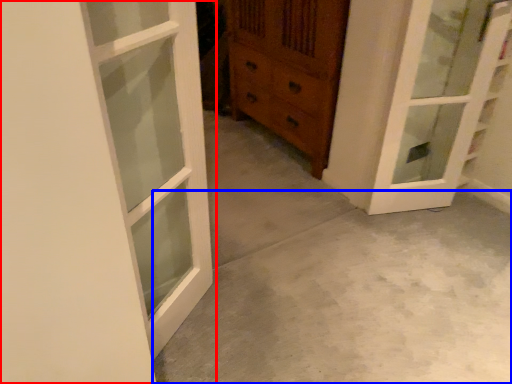
Question: Which of the following is the closest to the observer, door (highlighted by a red box) or concrete (highlighted by a blue box)?

Choices:
 (A) door
 (B) concrete

Answer: (A)